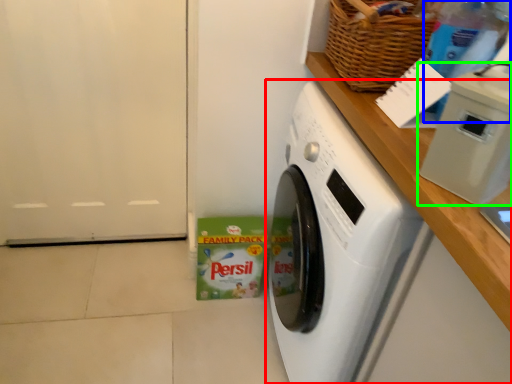
Question: Based on their relative distances, which object is nearer to washing machine (highlighted by a red box)? Choose from bottle (highlighted by a blue box) and appliance (highlighted by a green box).

Choices:
 (A) bottle
 (B) appliance

Answer: (B)